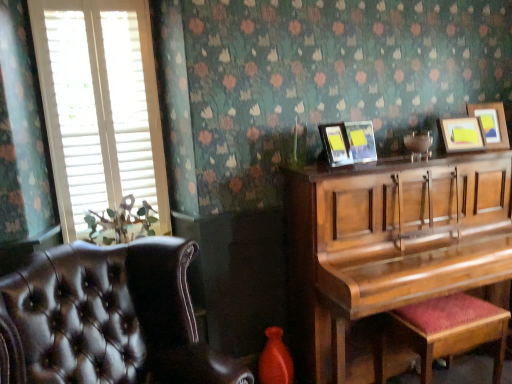
Question: Is matte black picture frame at upper center, the third picture frame viewed from the right, to the left or to the right of wooden picture frame at upper right, arranged as the first picture frame when viewed from the right, in the image?

Choices:
 (A) right
 (B) left

Answer: (B)

Question: From the image's perspective, is matte black picture frame at upper center, the 2th picture frame from the left, above or below wooden picture frame at upper right, acting as the 4th picture frame starting from the left?

Choices:
 (A) below
 (B) above

Answer: (A)

Question: Estimate the real-world distances between objects in this image. Which object is closer to the matte black picture frame at upper center, the third picture frame viewed from the right?

Choices:
 (A) white wood blinds at left
 (B) wooden picture frame at upper right, which ranks as the 4th picture frame in right-to-left order
 (C) velvet red music stool at lower right
 (D) leather at left
 (E) wooden picture frame at upper right, acting as the 4th picture frame starting from the left

Answer: (B)

Question: Which of these objects is positioned farthest from the wooden picture frame at upper right, acting as the 4th picture frame starting from the left?

Choices:
 (A) velvet red music stool at lower right
 (B) wooden picture frame at upper right, which ranks as the 1th picture frame in left-to-right order
 (C) wooden picture frame at upper right, the 2th picture frame when ordered from right to left
 (D) matte black picture frame at upper center, the 2th picture frame from the left
 (E) shiny brown piano at right

Answer: (A)